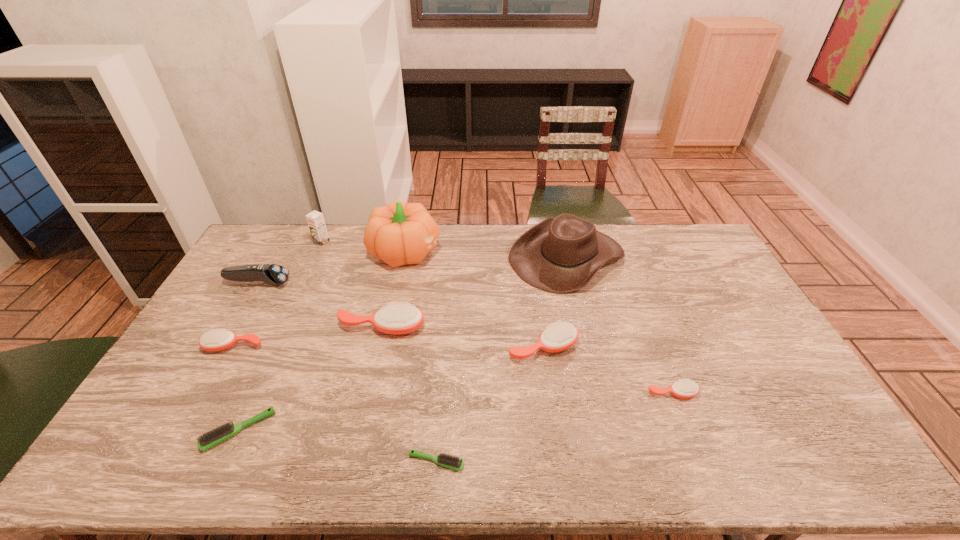
Where is `free spot that satisfies the following two spatial constraints: 1. on the head of the electric shaver; 2. on the back side of the leftmost orange hairbrush`? free spot that satisfies the following two spatial constraints: 1. on the head of the electric shaver; 2. on the back side of the leftmost orange hairbrush is located at coordinates (223, 346).

At what (x,y) coordinates should I click in order to perform the action: click on vacant position in the image that satisfies the following two spatial constraints: 1. on the head of the electric shaver; 2. on the right side of the right light hairbrush. Please return your answer as a coordinate pair (x, y). Image resolution: width=960 pixels, height=540 pixels. Looking at the image, I should click on (156, 462).

Find the location of a particular element. This screenshot has height=540, width=960. free location that satisfies the following two spatial constraints: 1. on the carved face of the pumpkin; 2. on the left side of the sixth tallest object is located at coordinates (386, 347).

Locate an element on the screen. The height and width of the screenshot is (540, 960). vacant point that satisfies the following two spatial constraints: 1. on the carved face of the tallest object; 2. on the front side of the bigger light hairbrush is located at coordinates (369, 430).

This screenshot has height=540, width=960. What are the coordinates of `free spot that satisfies the following two spatial constraints: 1. on the head of the left light hairbrush; 2. on the right side of the electric shaver` in the screenshot? It's located at (175, 430).

You are a GUI agent. You are given a task and a screenshot of the screen. Output one action in this format:
    pyautogui.click(x=<x>, y=<y>)
    Task: Click on the free location that satisfies the following two spatial constraints: 1. on the front side of the leftmost orange hairbrush; 2. on the left side of the second hairbrush from right to left
    This screenshot has width=960, height=540.
    Given the screenshot: What is the action you would take?
    pyautogui.click(x=233, y=347)